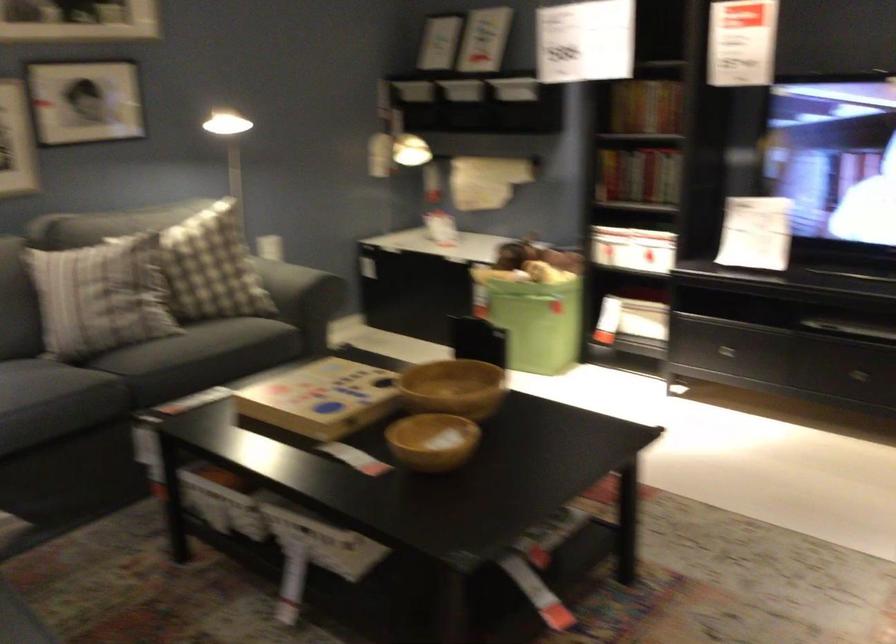
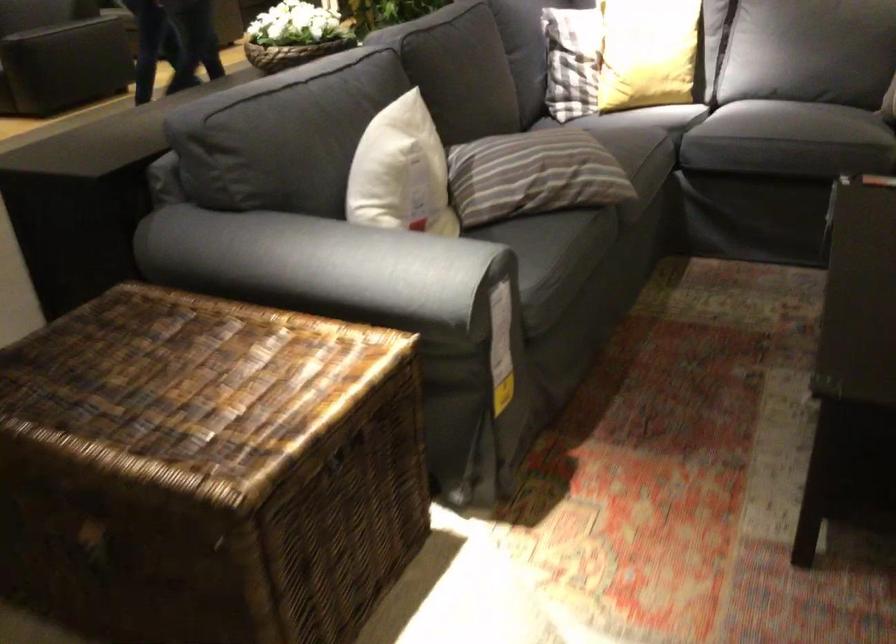
First-person continuous shooting, in which direction is the camera rotating?

The rotation direction of the camera is left-down.